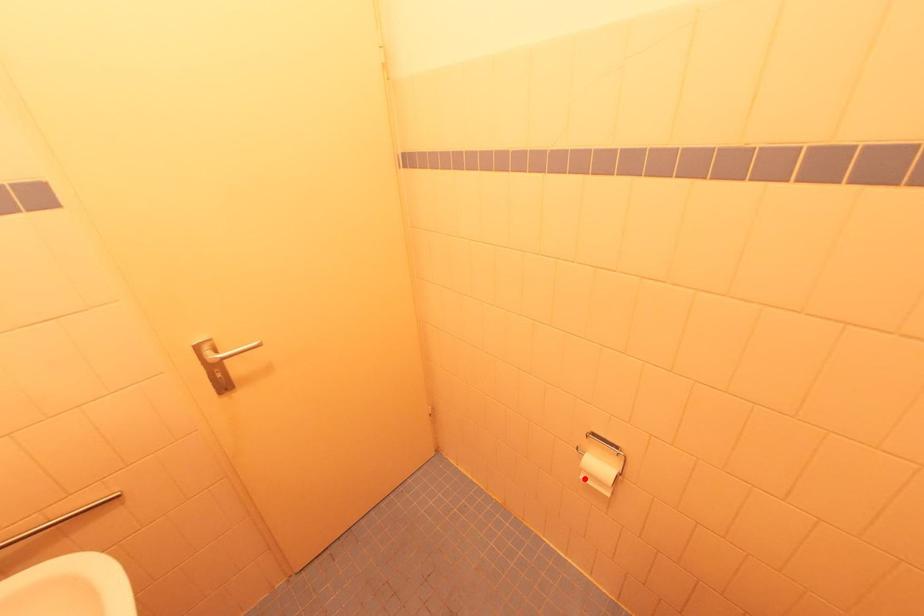
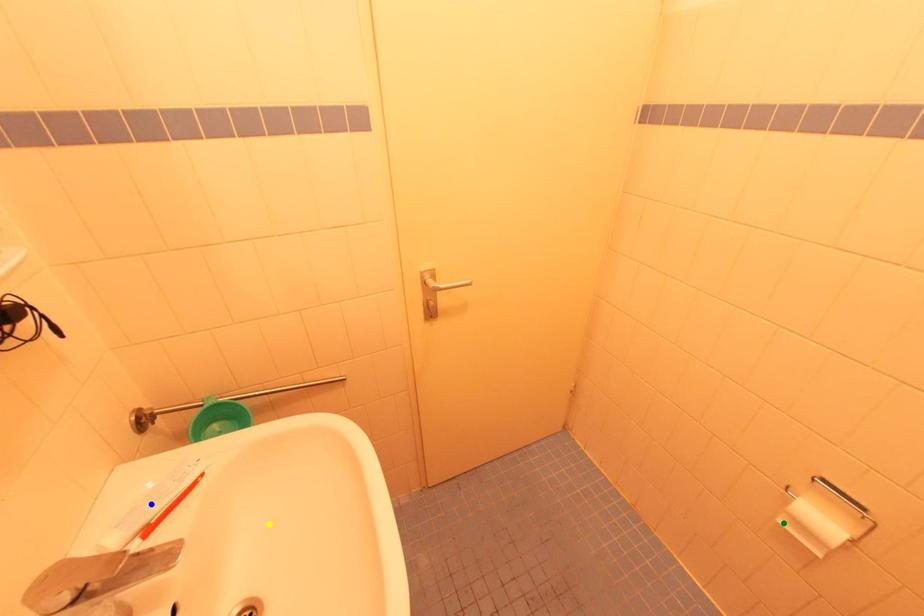
Question: I am providing you with two images of the same scene from different viewpoints. A red point is marked on the first image. You are given multiple points on the second image. Which point in image 2 is actually the same real-world point as the red point in image 1?

Choices:
 (A) green point
 (B) yellow point
 (C) blue point

Answer: (A)